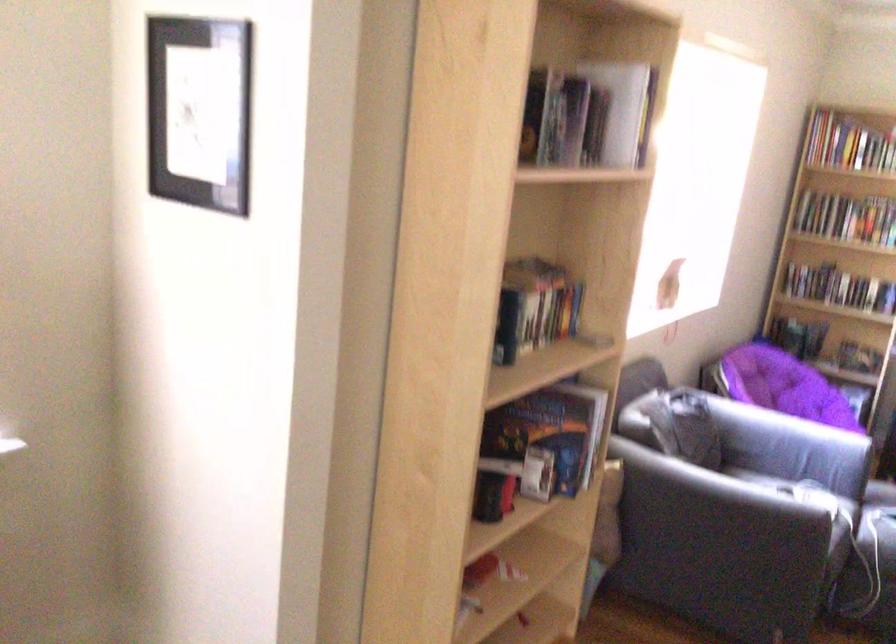
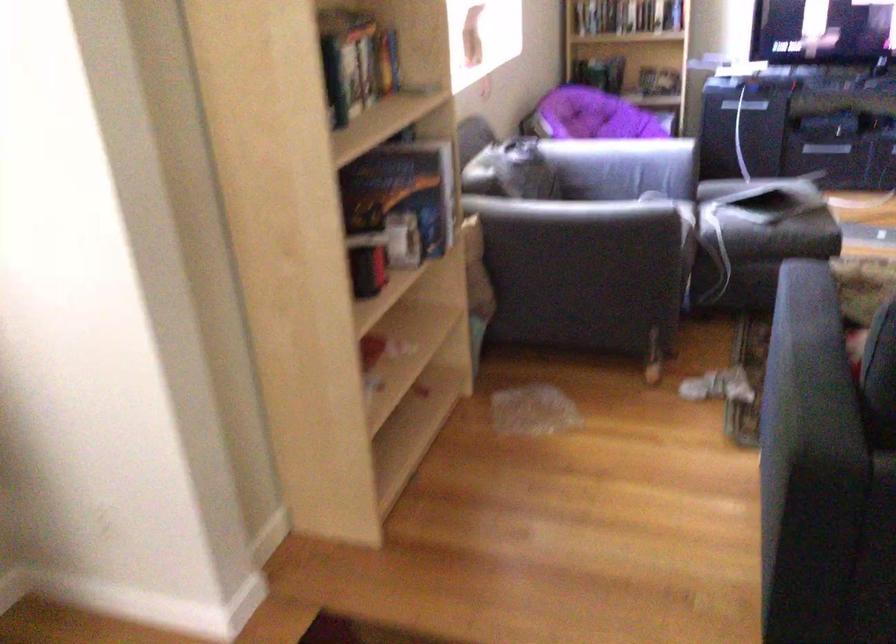
The point at (747,489) is marked in the first image. Where is the corresponding point in the second image?

(597, 212)